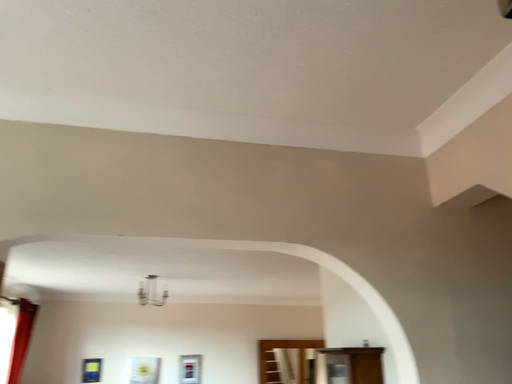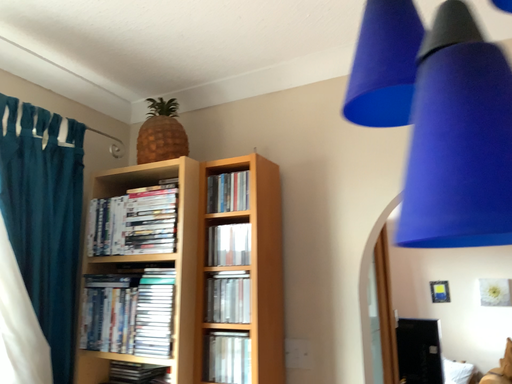
Question: Which way did the camera rotate in the video?

Choices:
 (A) rotated left
 (B) rotated right

Answer: (A)